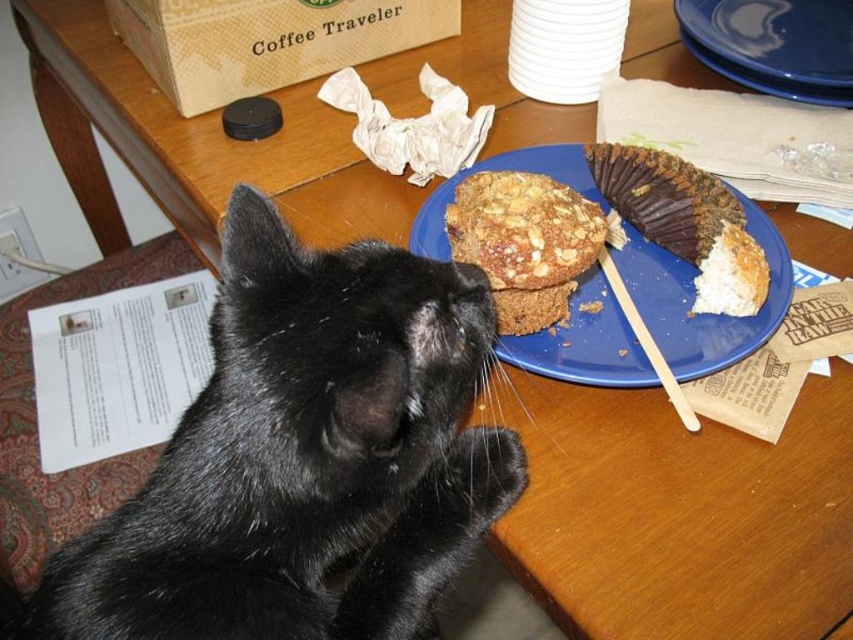
You are a cat trying to reach the food on the table. You see two points marked on the table. The first point is at coordinate point(646, 252) and the second point is at point(456, 244). Which point is closer to you?

Point(456, 244) is closer to you because it is in front of point(646, 252).